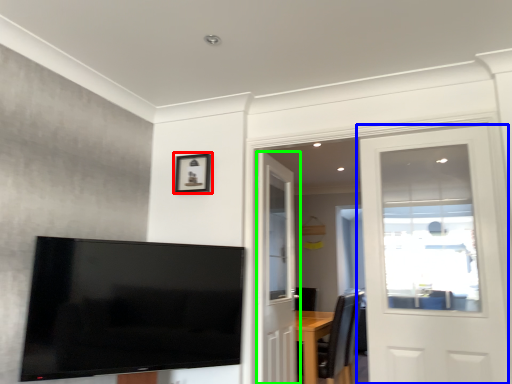
Question: Based on their relative distances, which object is nearer to picture frame (highlighted by a red box)? Choose from door (highlighted by a blue box) and door (highlighted by a green box).

Choices:
 (A) door
 (B) door

Answer: (B)